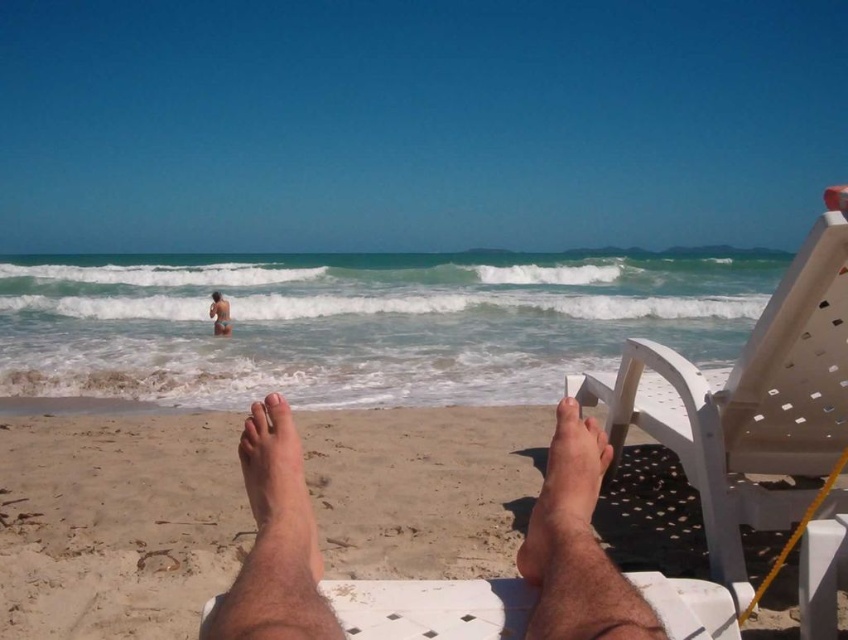
Between point (752, 460) and point (215, 312), which one is positioned in front?

Positioned in front is point (752, 460).

From the picture: Is white plastic beach chair at lower right smaller than skinny bikini at lower center?

No.

Between point (609, 412) and point (222, 296), which one is positioned behind?

The point (222, 296) is more distant.

Where is `white plastic beach chair at lower right`? white plastic beach chair at lower right is located at coordinates (x=752, y=404).

Is hairless skin at center smaller than pale skin at center?

Yes, hairless skin at center is smaller than pale skin at center.

Where is `hairless skin at center`? The image size is (848, 640). hairless skin at center is located at coordinates (577, 545).

Where is `hairless skin at center`? hairless skin at center is located at coordinates (577, 545).

Does point (255, 580) lie behind point (212, 308)?

No, (255, 580) is closer to viewer.

Locate an element on the screen. Image resolution: width=848 pixels, height=640 pixels. pale skin at center is located at coordinates (277, 492).